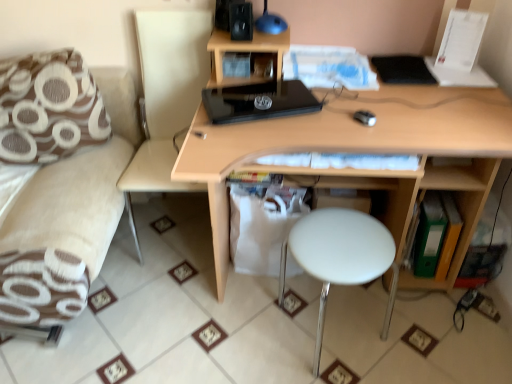
Locate an element on the screen. This screenshot has height=384, width=512. free space that is in between white glossy stool at center and light wood desk at center is located at coordinates (343, 359).